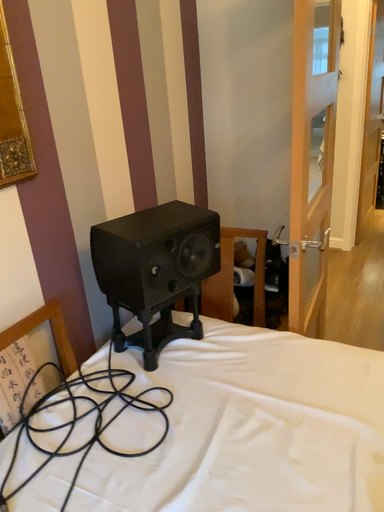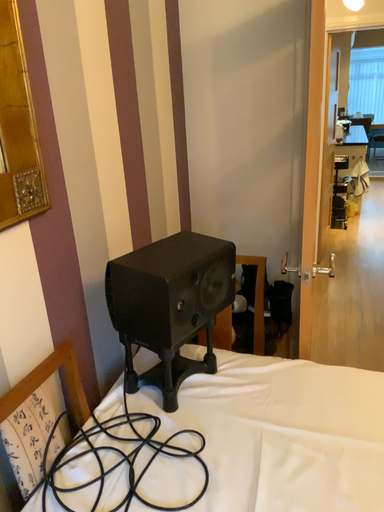
Question: How did the camera likely rotate when shooting the video?

Choices:
 (A) rotated left
 (B) rotated right

Answer: (B)